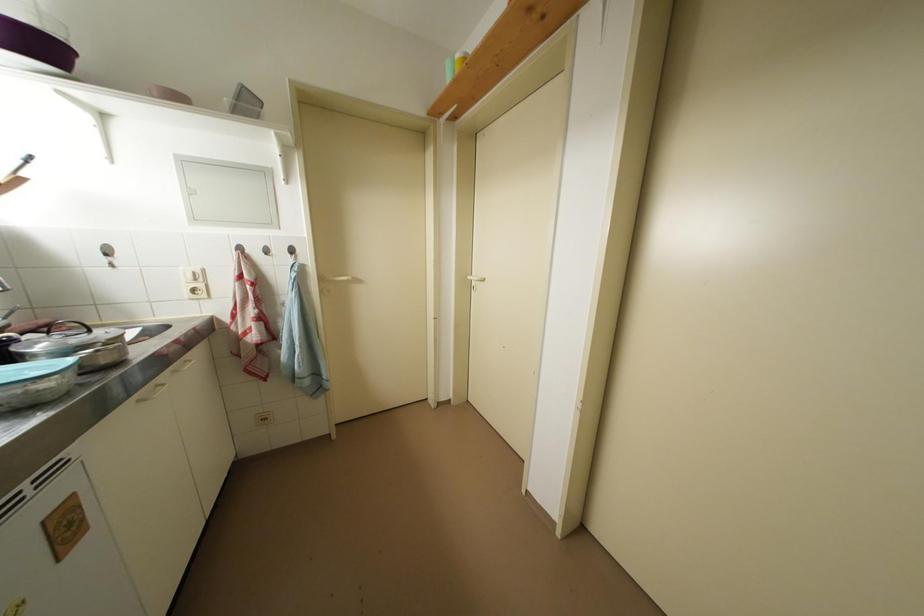
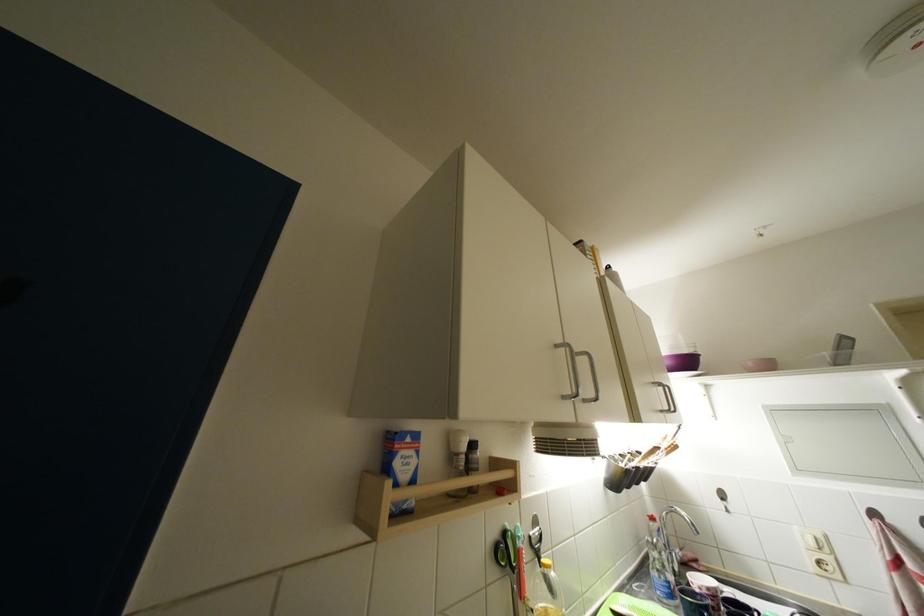
Locate, in the second image, the point that corresponds to point 198,282 in the first image.

(820, 548)